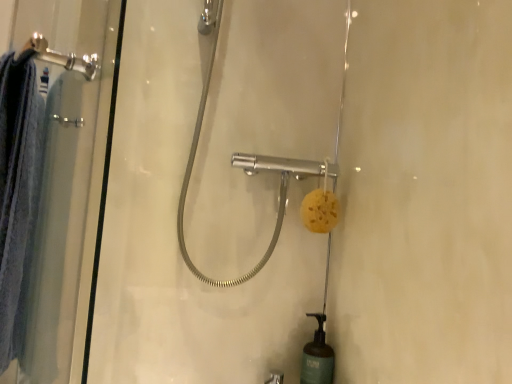
Question: From a real-world perspective, relative to clear glass shower door at left, is yellow sponge at center vertically above or below?

Choices:
 (A) below
 (B) above

Answer: (B)

Question: From the image's perspective, is yellow sponge at center above or below clear glass shower door at left?

Choices:
 (A) above
 (B) below

Answer: (A)

Question: In the image, is yellow sponge at center positioned in front of or behind clear glass shower door at left?

Choices:
 (A) front
 (B) behind

Answer: (B)

Question: From the image's perspective, relative to yellow sponge at center, is clear glass shower door at left above or below?

Choices:
 (A) below
 (B) above

Answer: (A)

Question: In terms of width, does clear glass shower door at left look wider or thinner when compared to yellow sponge at center?

Choices:
 (A) thin
 (B) wide

Answer: (A)

Question: Is clear glass shower door at left taller or shorter than yellow sponge at center?

Choices:
 (A) short
 (B) tall

Answer: (B)

Question: From a real-world perspective, is clear glass shower door at left physically located above or below yellow sponge at center?

Choices:
 (A) below
 (B) above

Answer: (A)